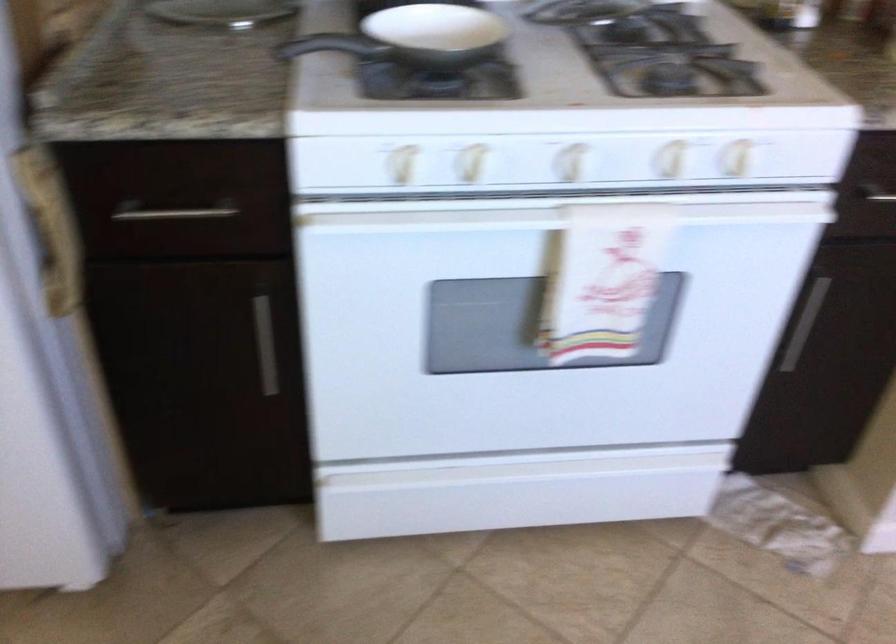
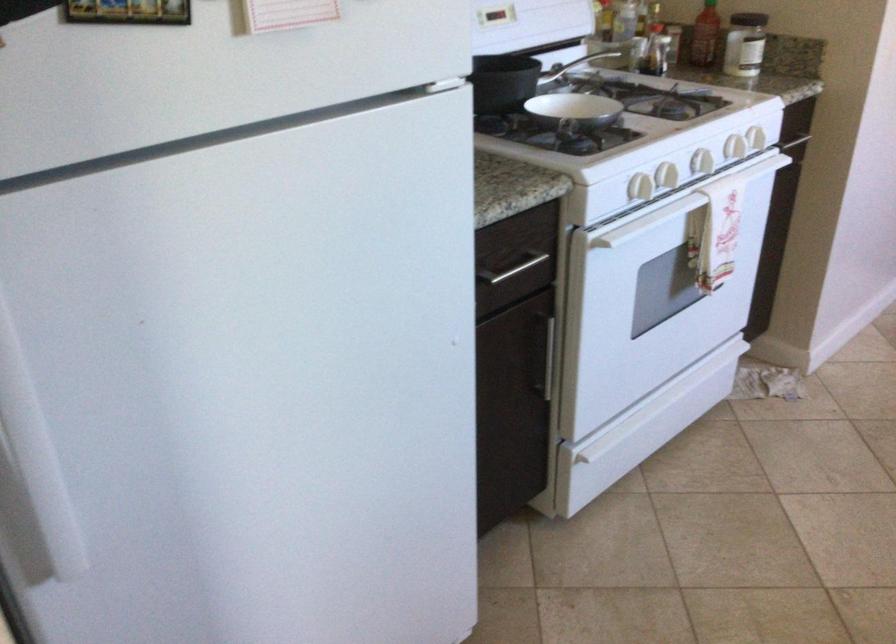
Find the pixel in the second image that matches point 664,211 in the first image.

(755, 138)